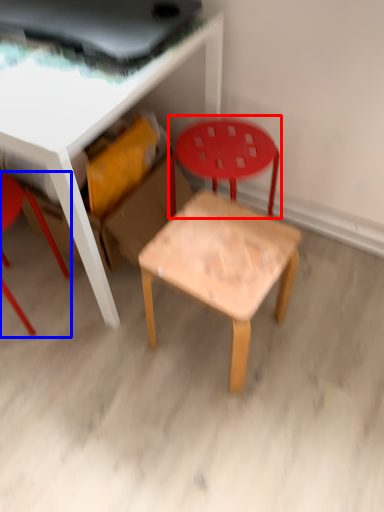
Question: Which point is further to the camera, chair (highlighted by a red box) or chair (highlighted by a blue box)?

Choices:
 (A) chair
 (B) chair

Answer: (A)